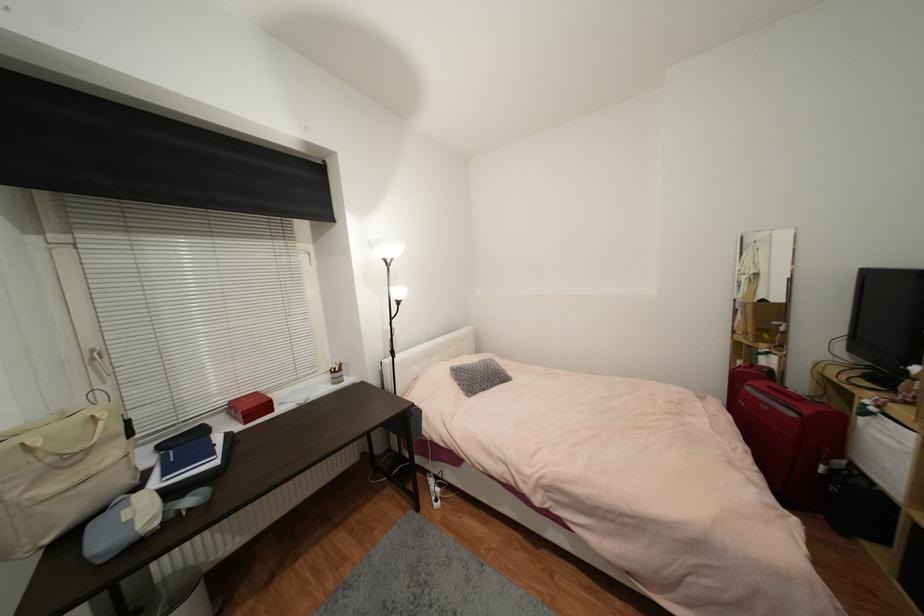
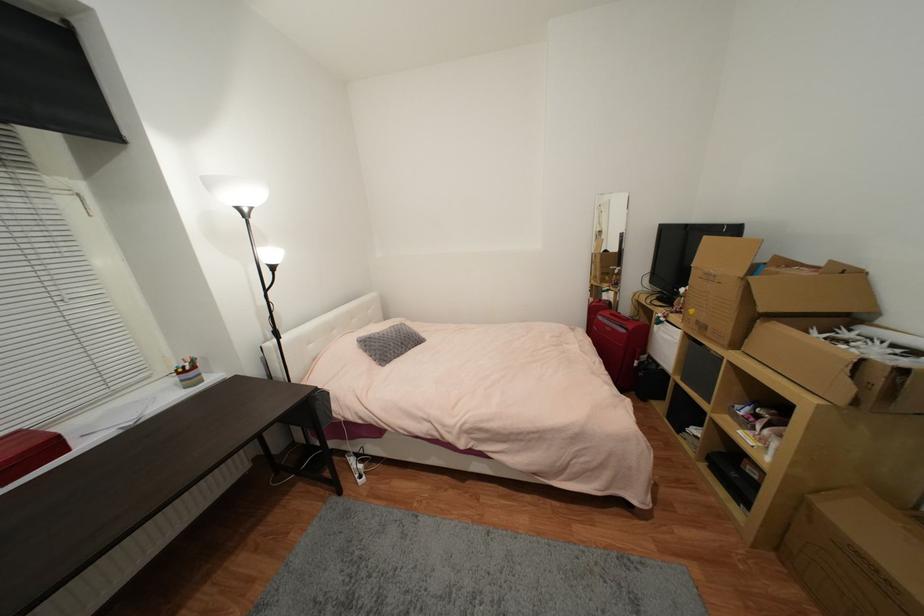
Locate, in the second image, the point that corresponds to (x=857, y=467) in the first image.

(653, 359)